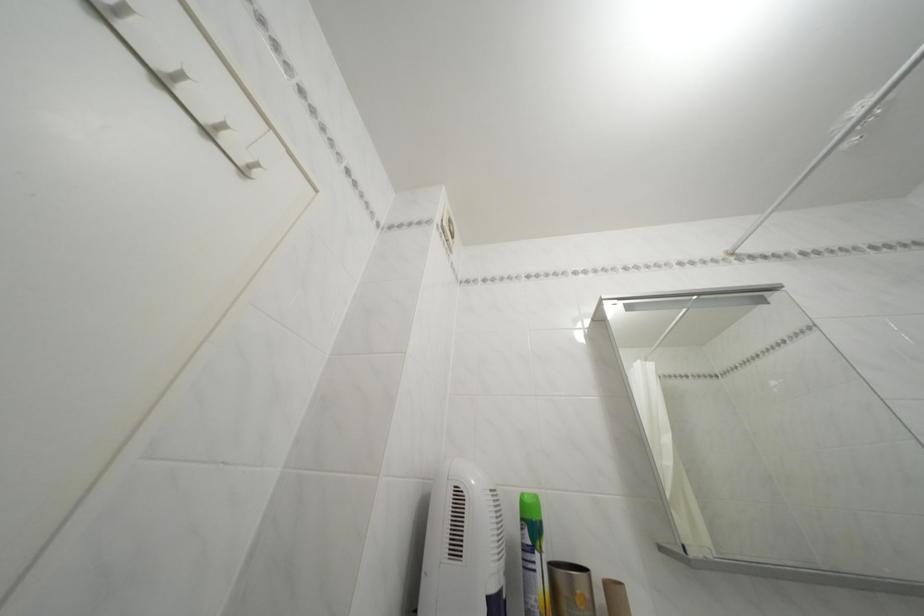
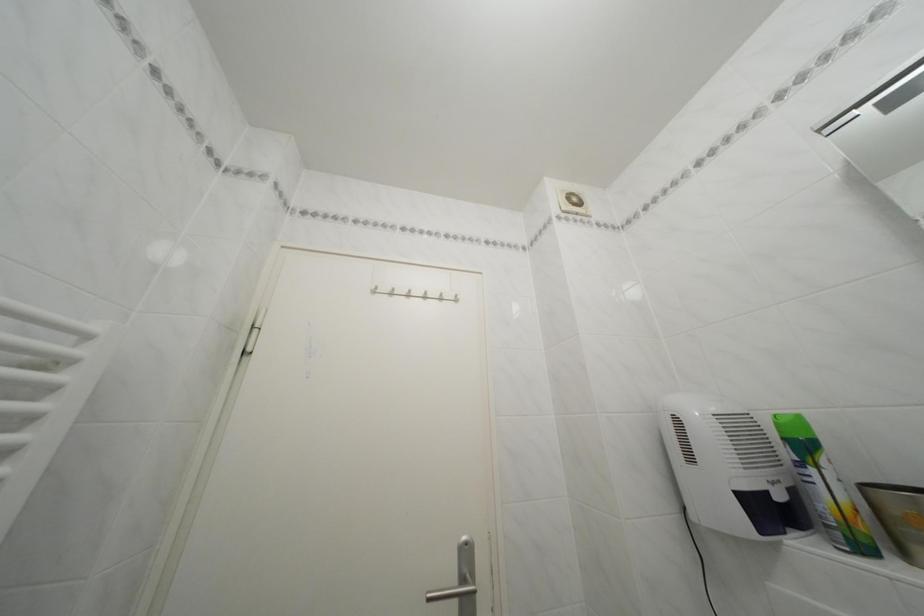
Locate, in the second image, the point that corresponds to point 465,554 in the first image.

(699, 464)